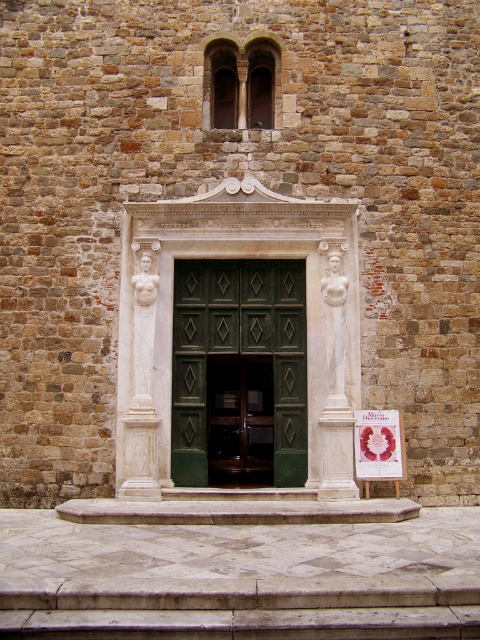
Question: Which object is farther from the camera taking this photo?

Choices:
 (A) matte pink paper at center
 (B) white marble statue at center

Answer: (A)

Question: Is the position of green wooden door at center more distant than that of white marble statue at center?

Choices:
 (A) yes
 (B) no

Answer: (A)

Question: Where is white marble statue at center located in relation to matte pink paper at center in the image?

Choices:
 (A) left
 (B) right

Answer: (A)

Question: Which point appears closest to the camera in this image?

Choices:
 (A) (395, 458)
 (B) (218, 307)

Answer: (A)

Question: Does green wooden door at center appear on the right side of matte pink paper at center?

Choices:
 (A) yes
 (B) no

Answer: (B)

Question: Among these objects, which one is farthest from the camera?

Choices:
 (A) white marble statue at center
 (B) green wooden door at center
 (C) matte pink paper at center

Answer: (B)